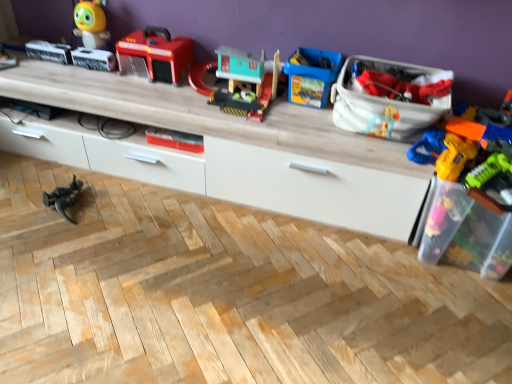
Where is `vacant region under matte plastic toy house at center, which is the 3th toy in right-to-left order (from a real-world perspective)`? Image resolution: width=512 pixels, height=384 pixels. vacant region under matte plastic toy house at center, which is the 3th toy in right-to-left order (from a real-world perspective) is located at coordinates (224, 97).